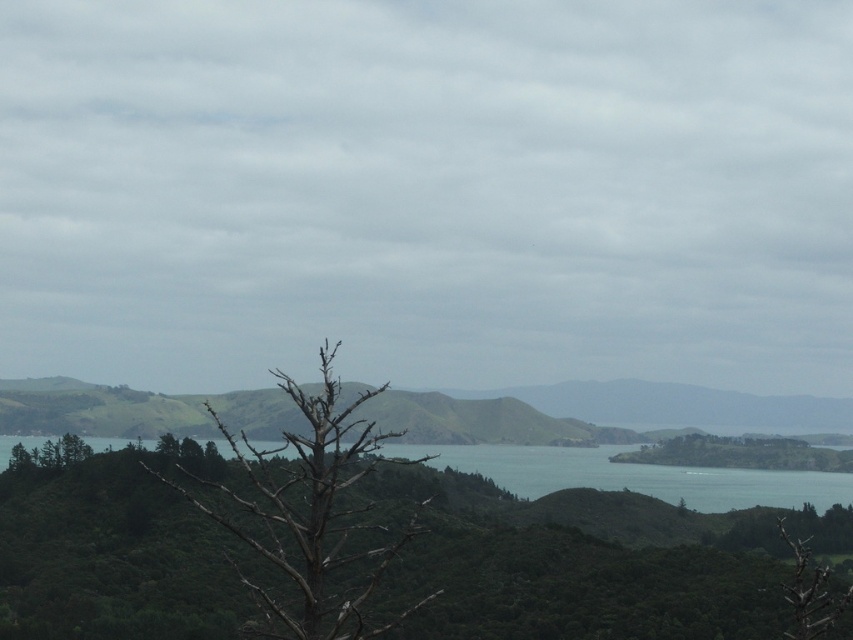
Question: Can you confirm if bare wood tree at center is positioned above green water at center?

Choices:
 (A) no
 (B) yes

Answer: (B)

Question: Which of the following is the farthest from the observer?

Choices:
 (A) green water at center
 (B) bare wood tree at center

Answer: (A)

Question: Is bare wood tree at center bigger than green water at center?

Choices:
 (A) yes
 (B) no

Answer: (B)

Question: Which point appears farthest from the camera in this image?

Choices:
 (A) (349, 556)
 (B) (222, 448)

Answer: (B)

Question: Is bare wood tree at center smaller than green water at center?

Choices:
 (A) no
 (B) yes

Answer: (B)

Question: Which object appears closest to the camera in this image?

Choices:
 (A) bare wood tree at center
 (B) green water at center

Answer: (A)